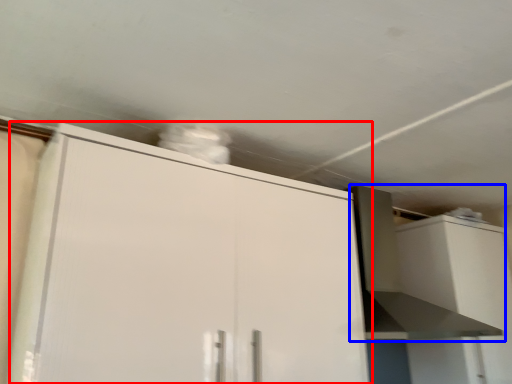
Question: Which object is further to the camera taking this photo, cabinetry (highlighted by a red box) or vent (highlighted by a blue box)?

Choices:
 (A) cabinetry
 (B) vent

Answer: (B)